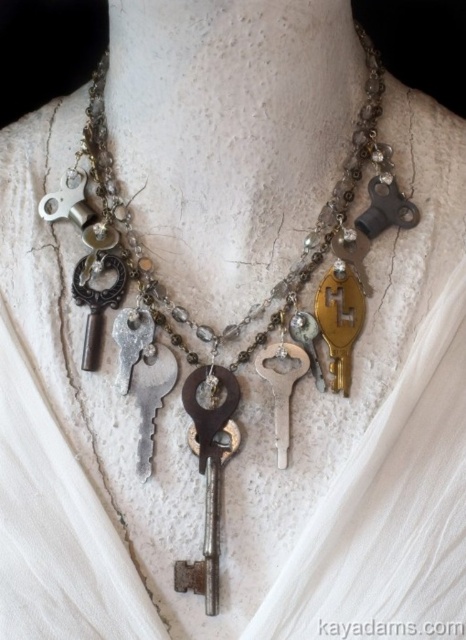
Locate an element on the screen. The height and width of the screenshot is (640, 466). antique silver keys at center is located at coordinates (305, 241).

Looking at this image, can you confirm if antique silver keys at center is positioned to the left of silver metallic key at center?

Correct, you'll find antique silver keys at center to the left of silver metallic key at center.

Where is `antique silver keys at center`? This screenshot has width=466, height=640. antique silver keys at center is located at coordinates (305, 241).

Does antique silver keys at center have a lesser height compared to gold metallic key at center?

Incorrect, antique silver keys at center's height does not fall short of gold metallic key at center's.

Is point (321, 228) closer to viewer compared to point (342, 300)?

No, (321, 228) is behind (342, 300).

In order to click on antique silver keys at center in this screenshot , I will do `click(305, 241)`.

Locate an element on the screen. antique silver keys at center is located at coordinates (305, 241).

At what (x,y) coordinates should I click in order to perform the action: click on gold metallic key at center. Please return your answer as a coordinate pair (x, y). Looking at the image, I should click on (340, 320).

Is gold metallic key at center positioned before silver metallic key at center?

That is False.

I want to click on gold metallic key at center, so click(340, 320).